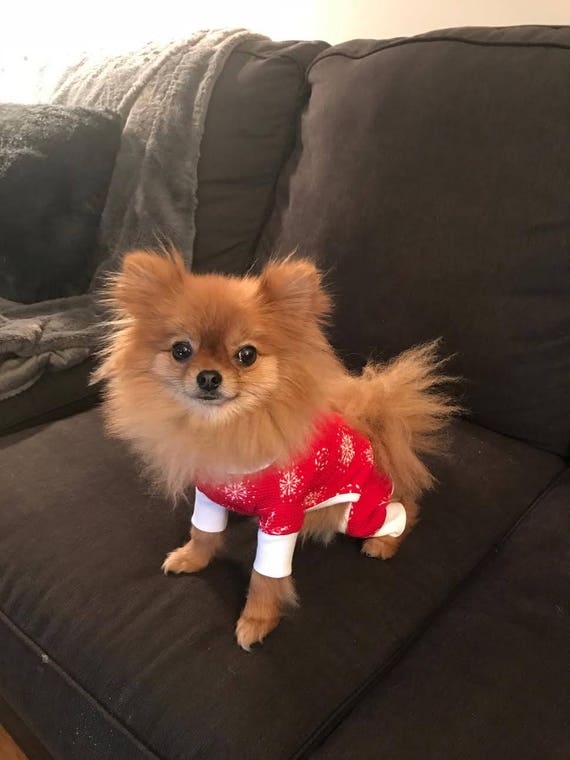
Identify the location of couch cushion. (92, 606), (426, 282).